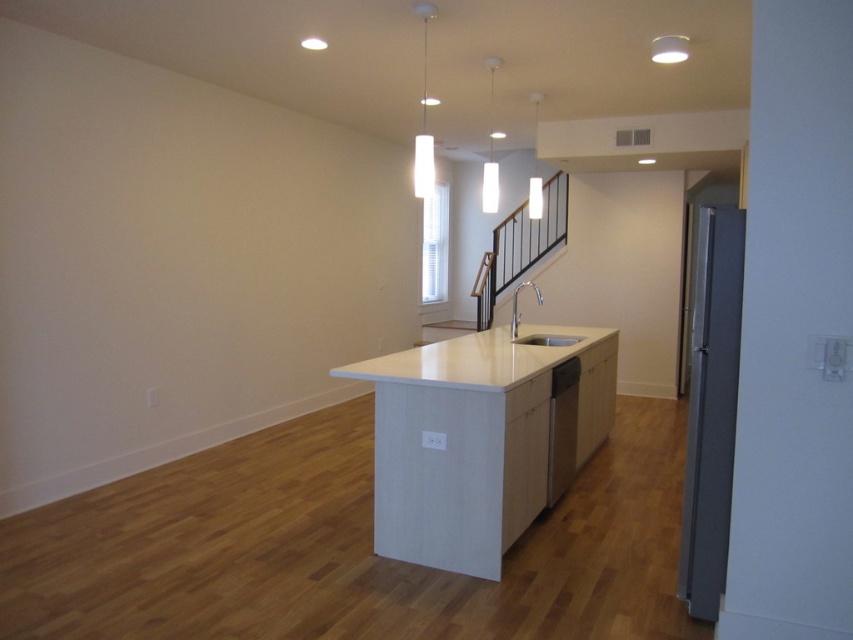
Is white laminate counter top at center closer to camera compared to white glossy sink at center?

Yes, white laminate counter top at center is closer to the viewer.

Which of these two, white laminate counter top at center or white glossy sink at center, stands shorter?

Standing shorter between the two is white glossy sink at center.

Is point (529, 500) behind point (561, 346)?

No, (529, 500) is closer to viewer.

Find the location of a particular element. white laminate counter top at center is located at coordinates (480, 438).

Which is below, white matte dishwasher at center or white glossy sink at center?

Positioned lower is white matte dishwasher at center.

Which of these two, white matte dishwasher at center or white glossy sink at center, stands taller?

white matte dishwasher at center is taller.

What are the coordinates of `white matte dishwasher at center` in the screenshot? It's located at (561, 428).

Who is shorter, white glossy countertop at center or white matte dishwasher at center?

With less height is white glossy countertop at center.

Identify the location of white glossy countertop at center. (486, 356).